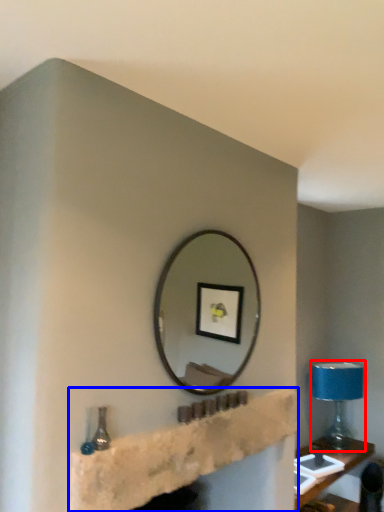
Question: Which object appears closest to the camera in this image, table lamp (highlighted by a red box) or shelf (highlighted by a blue box)?

Choices:
 (A) table lamp
 (B) shelf

Answer: (B)